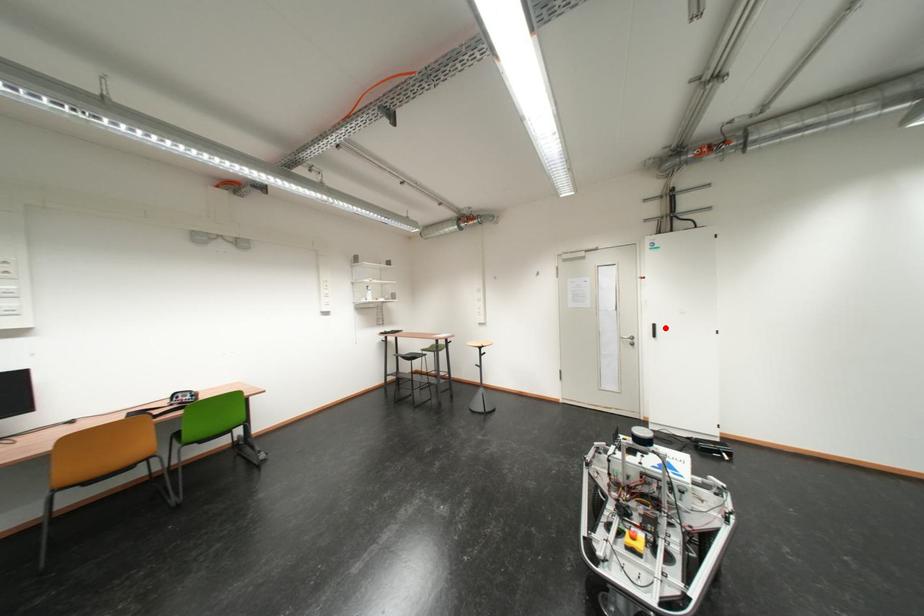
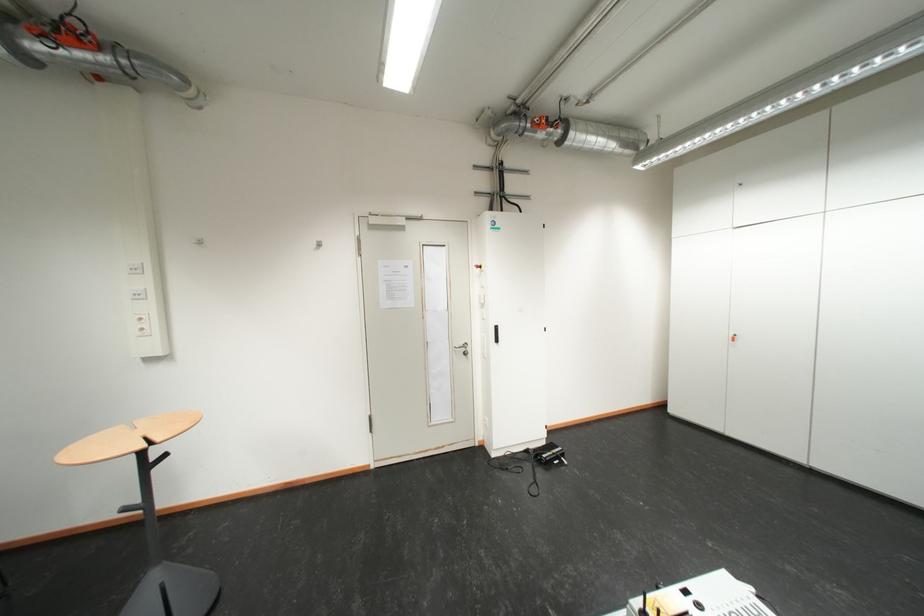
In the second image, find the point that corresponds to the highlighted location in the first image.

(507, 330)